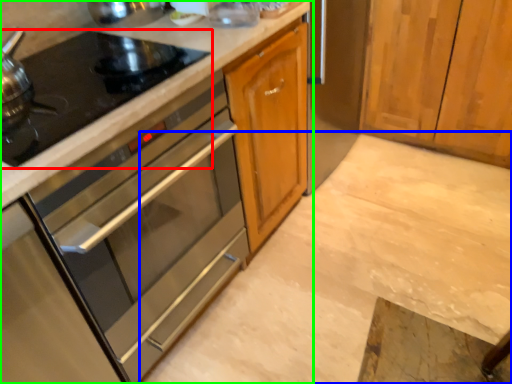
Question: Considering the real-world distances, which object is farthest from gas stove (highlighted by a red box)? concrete (highlighted by a blue box) or cabinetry (highlighted by a green box)?

Choices:
 (A) concrete
 (B) cabinetry

Answer: (A)